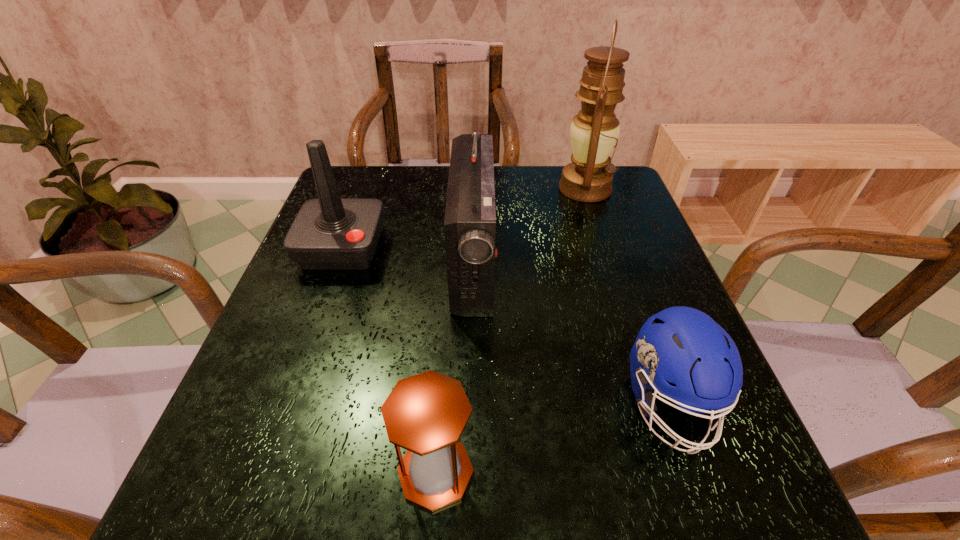
The image size is (960, 540). Find the location of `free spot between the radio receiver and the third shortest object`. free spot between the radio receiver and the third shortest object is located at coordinates (408, 255).

Where is `free space between the farthest object and the football helmet`? free space between the farthest object and the football helmet is located at coordinates (628, 296).

This screenshot has height=540, width=960. What are the coordinates of `vacant area that lies between the radio receiver and the football helmet` in the screenshot? It's located at (571, 333).

Identify the location of object identified as the third closest to the tallest object. (682, 345).

Locate an element on the screen. The width and height of the screenshot is (960, 540). the second closest object to the hourglass is located at coordinates (682, 345).